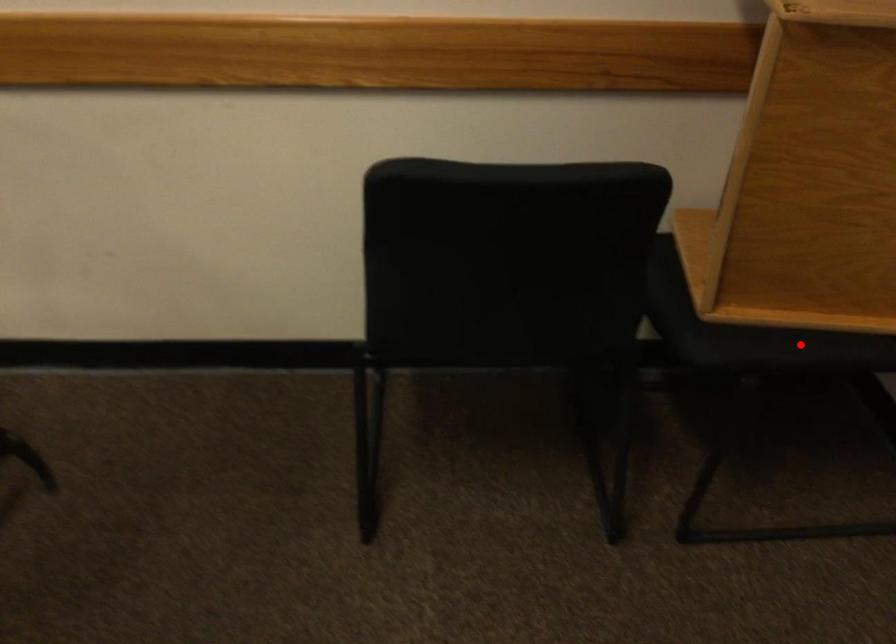
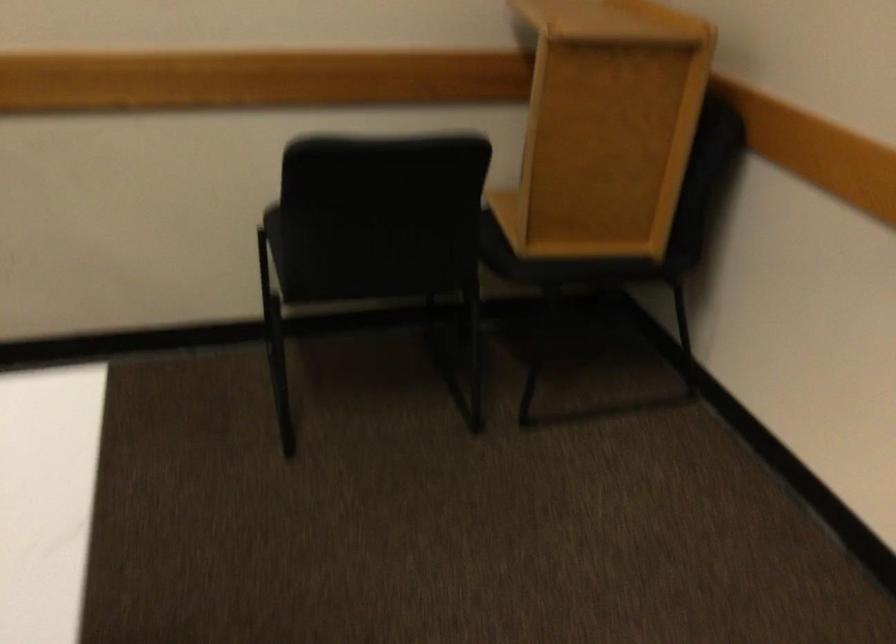
Question: I am providing you with two images of the same scene from different viewpoints. Given a red point in image1, look at the same physical point in image2. Is it:

Choices:
 (A) Closer to the viewpoint
 (B) Farther from the viewpoint

Answer: (B)